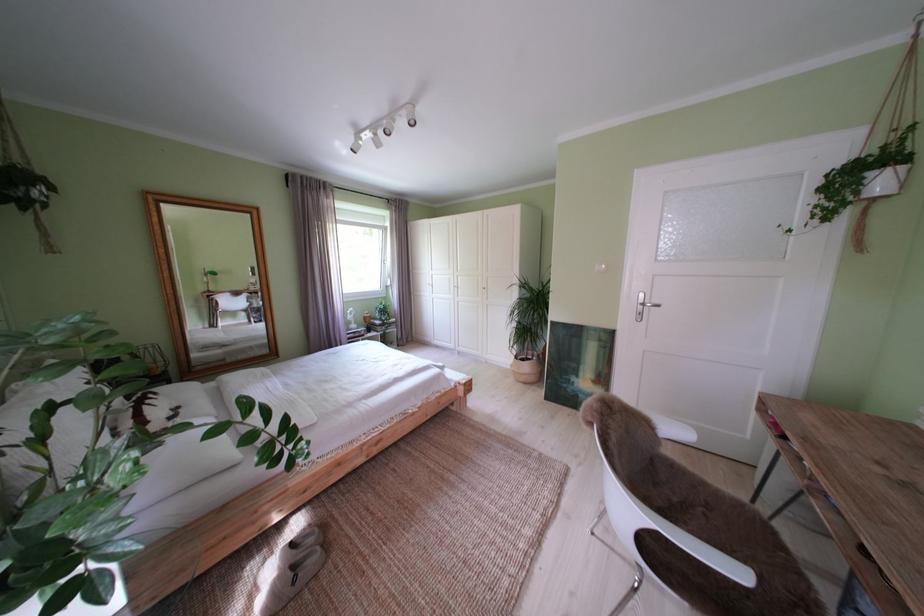
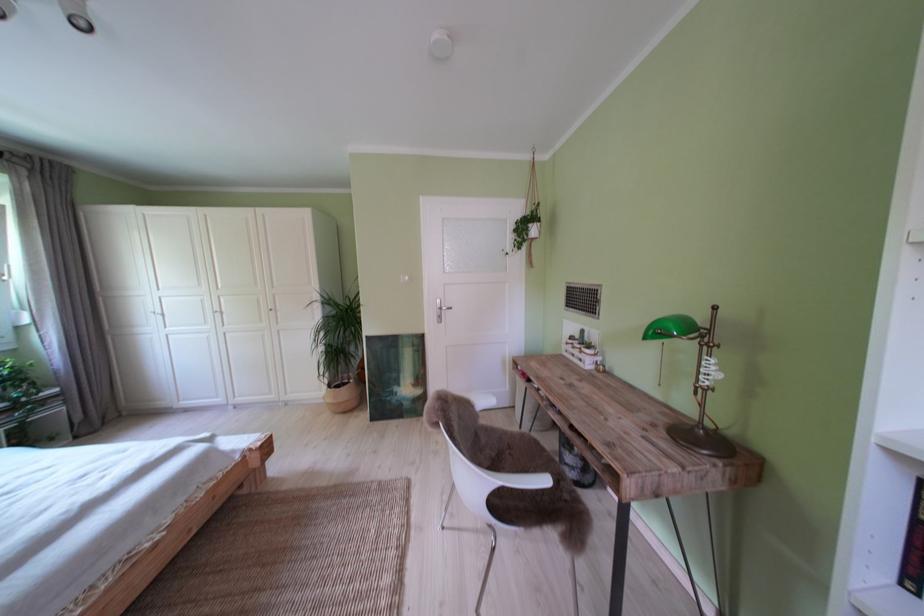
Locate, in the second image, the point that corresponds to pixel 576 391 in the first image.

(399, 403)